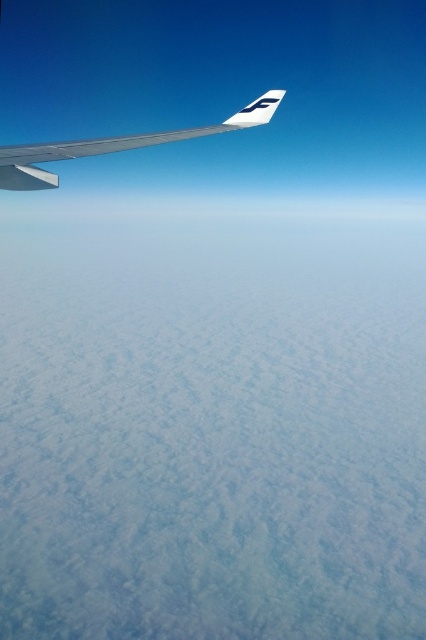
You are a passenger sitting by the window and want to take a photo of the metallic silver winglet at upper left and the white fluffy cloud at lower left. Which object will appear closer to you in the photo?

The white fluffy cloud at lower left will appear closer to you in the photo because it is further to the viewer than the metallic silver winglet at upper left.

You are a pilot who needs to ensure there are no large obstacles near the winglet. Based on the scene, can you confirm if the white fluffy cloud at lower left is larger than the metallic silver winglet at upper left?

Yes, the white fluffy cloud at lower left is bigger than the metallic silver winglet at upper left according to the description.

You are a pilot checking the weather conditions. You notice the white fluffy cloud at lower left and the metallic silver winglet at upper left. Which object has a greater width?

The white fluffy cloud at lower left has a greater width than the metallic silver winglet at upper left.